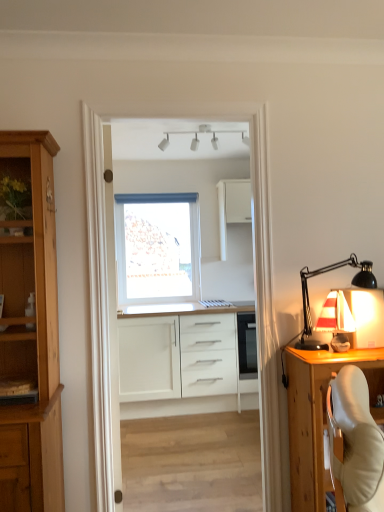
Question: Would you say white matte window at center is outside matte white sailboat at right?

Choices:
 (A) no
 (B) yes

Answer: (B)

Question: Is white matte window at center shorter than matte white sailboat at right?

Choices:
 (A) no
 (B) yes

Answer: (A)

Question: Can you confirm if white matte window at center is taller than matte white sailboat at right?

Choices:
 (A) no
 (B) yes

Answer: (B)

Question: Is white matte window at center far away from matte white sailboat at right?

Choices:
 (A) yes
 (B) no

Answer: (A)

Question: Considering the relative sizes of white matte window at center and matte white sailboat at right in the image provided, is white matte window at center bigger than matte white sailboat at right?

Choices:
 (A) yes
 (B) no

Answer: (A)

Question: Is white matte window at center inside or outside of white matte track lights at upper center, the first lamp in the left-to-right sequence?

Choices:
 (A) outside
 (B) inside

Answer: (A)

Question: Based on their positions, is white matte window at center located to the left or right of white matte track lights at upper center, acting as the 2th lamp starting from the right?

Choices:
 (A) right
 (B) left

Answer: (B)

Question: In terms of height, does white matte window at center look taller or shorter compared to white matte track lights at upper center, the first lamp viewed from the top?

Choices:
 (A) short
 (B) tall

Answer: (B)

Question: Considering their positions, is white matte window at center located in front of or behind white matte track lights at upper center, which is the second lamp in front-to-back order?

Choices:
 (A) behind
 (B) front

Answer: (A)

Question: From a real-world perspective, relative to white matte track lights at upper center, the first lamp in the left-to-right sequence, is wooden cabinet at right, acting as the 2th cabinetry starting from the bottom, vertically above or below?

Choices:
 (A) above
 (B) below

Answer: (B)

Question: Which is correct: wooden cabinet at right, acting as the 2th cabinetry starting from the bottom, is inside white matte track lights at upper center, the first lamp in the left-to-right sequence, or outside of it?

Choices:
 (A) inside
 (B) outside

Answer: (B)

Question: From the image's perspective, is wooden cabinet at right, arranged as the 1th cabinetry when viewed from the front, located above or below white matte track lights at upper center, acting as the 2th lamp starting from the right?

Choices:
 (A) below
 (B) above

Answer: (A)

Question: Considering the positions of wooden cabinet at right, acting as the 2th cabinetry starting from the bottom, and white matte track lights at upper center, which appears as the 1th lamp when viewed from the back, in the image, is wooden cabinet at right, acting as the 2th cabinetry starting from the bottom, taller or shorter than white matte track lights at upper center, which appears as the 1th lamp when viewed from the back,?

Choices:
 (A) tall
 (B) short

Answer: (A)

Question: Would you say white glossy door at center is to the left or to the right of matte white sailboat at right in the picture?

Choices:
 (A) left
 (B) right

Answer: (A)

Question: Is white glossy door at center situated inside matte white sailboat at right or outside?

Choices:
 (A) inside
 (B) outside

Answer: (B)